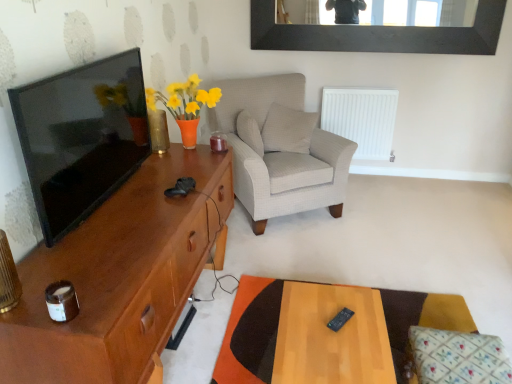
Question: From the image's perspective, relative to white plastic radiator at center right, is brown wood cabinet at left above or below?

Choices:
 (A) below
 (B) above

Answer: (A)

Question: In terms of height, does brown wood cabinet at left look taller or shorter compared to white plastic radiator at center right?

Choices:
 (A) short
 (B) tall

Answer: (B)

Question: Based on their relative distances, which object is farther from the white textured pillow at center, the third pillow positioned from the bottom?

Choices:
 (A) light gray fabric armchair at center
 (B) white textured pillow at center, positioned as the second pillow in top-to-bottom order
 (C) translucent glass vase at left
 (D) matte black tv at left
 (E) black matte picture frame at upper center

Answer: (D)

Question: Which of these objects is positioned farthest from the black plastic remote at center?

Choices:
 (A) white textured pillow at center, which is counted as the 2th pillow, starting from the right
 (B) matte black tv at left
 (C) wooden table at lower right
 (D) brown wood cabinet at left
 (E) wooden rectangular table at center

Answer: (A)